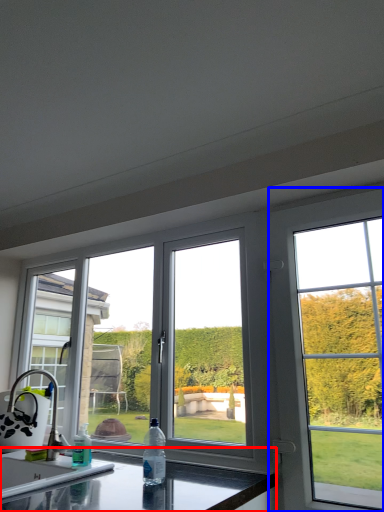
Question: Which point is closer to the camera, countertop (highlighted by a red box) or window (highlighted by a blue box)?

Choices:
 (A) countertop
 (B) window

Answer: (A)